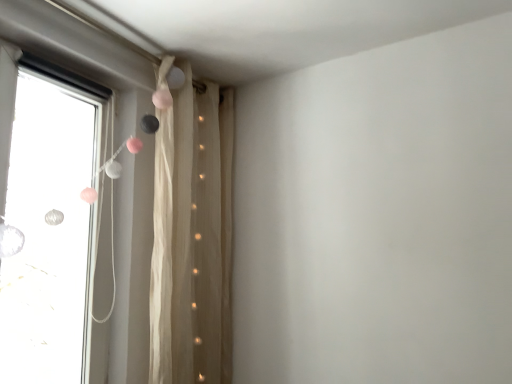
Question: Based on their positions, is sheer beige curtain at upper center located to the left or right of transparent glass window at left?

Choices:
 (A) left
 (B) right

Answer: (B)

Question: From the image's perspective, is sheer beige curtain at upper center located above or below transparent glass window at left?

Choices:
 (A) above
 (B) below

Answer: (B)

Question: From a real-world perspective, relative to transparent glass window at left, is sheer beige curtain at upper center vertically above or below?

Choices:
 (A) below
 (B) above

Answer: (A)

Question: Is transparent glass window at left to the left or to the right of sheer beige curtain at upper center in the image?

Choices:
 (A) left
 (B) right

Answer: (A)

Question: From a real-world perspective, is transparent glass window at left positioned above or below sheer beige curtain at upper center?

Choices:
 (A) below
 (B) above

Answer: (B)

Question: Choose the correct answer: Is transparent glass window at left inside sheer beige curtain at upper center or outside it?

Choices:
 (A) outside
 (B) inside

Answer: (A)

Question: Considering the positions of transparent glass window at left and sheer beige curtain at upper center in the image, is transparent glass window at left bigger or smaller than sheer beige curtain at upper center?

Choices:
 (A) big
 (B) small

Answer: (B)